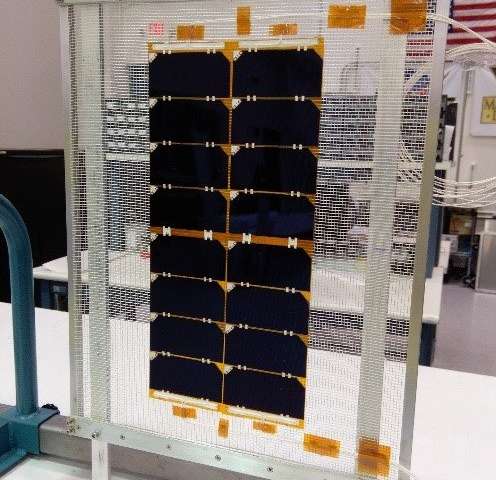
The height and width of the screenshot is (480, 496). I want to click on table legs, so click(54, 294), click(429, 344).